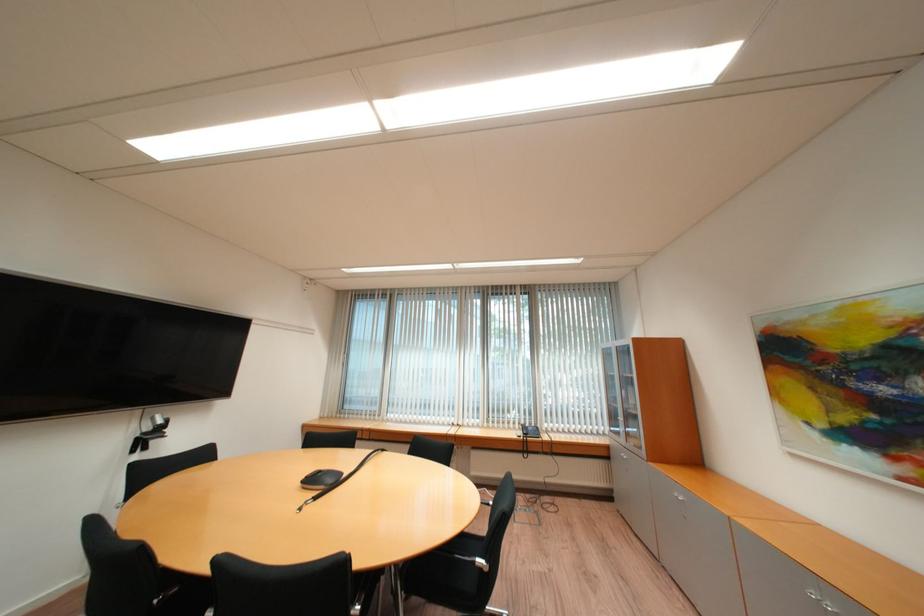
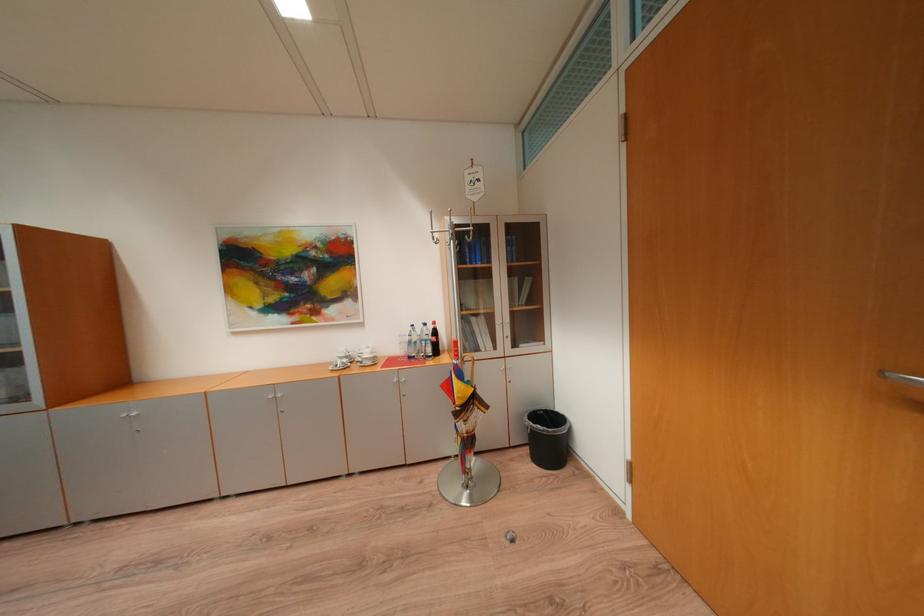
Question: The images are taken continuously from a first-person perspective. In which direction is your viewpoint rotating?

Choices:
 (A) Left
 (B) Right
 (C) Up
 (D) Down

Answer: (B)